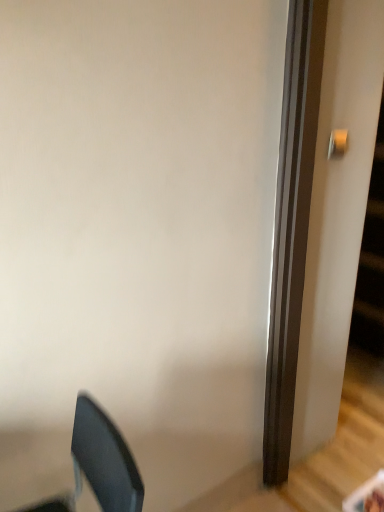
Find the location of a particular element. The image size is (384, 512). gold metallic door handle at upper right is located at coordinates (337, 143).

In order to face gold metallic door handle at upper right, should I rotate leftwards or rightwards?

A 19.213 degree turn to the right will do.

Describe the element at coordinates (337, 143) in the screenshot. Image resolution: width=384 pixels, height=512 pixels. I see `gold metallic door handle at upper right` at that location.

Identify the location of gold metallic door handle at upper right. (337, 143).